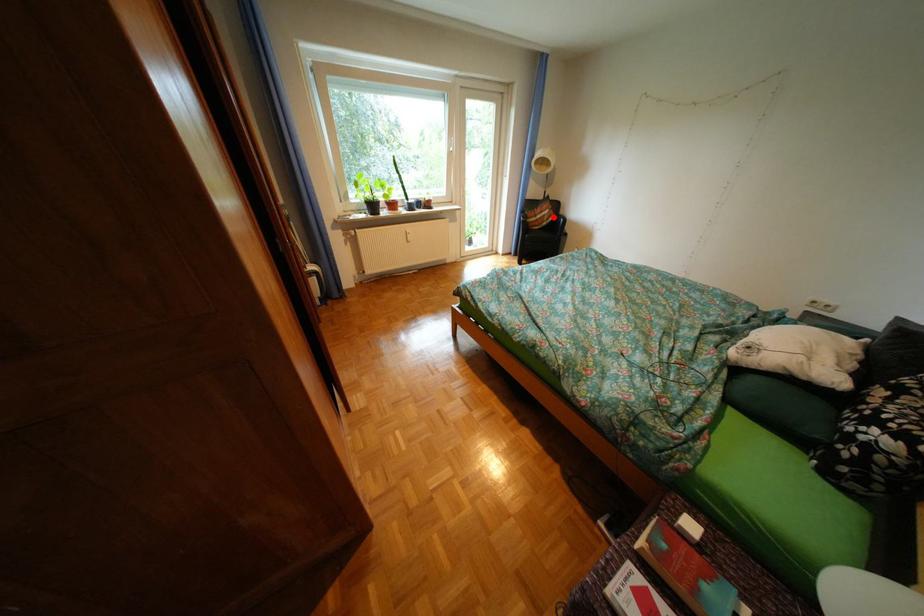
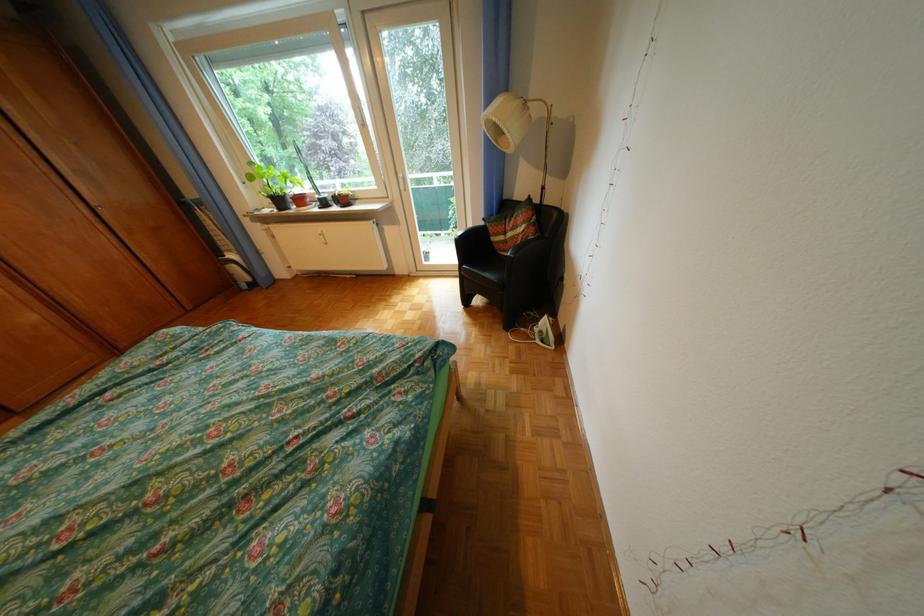
The point at the highlighted location is marked in the first image. Where is the corresponding point in the second image?

(524, 236)